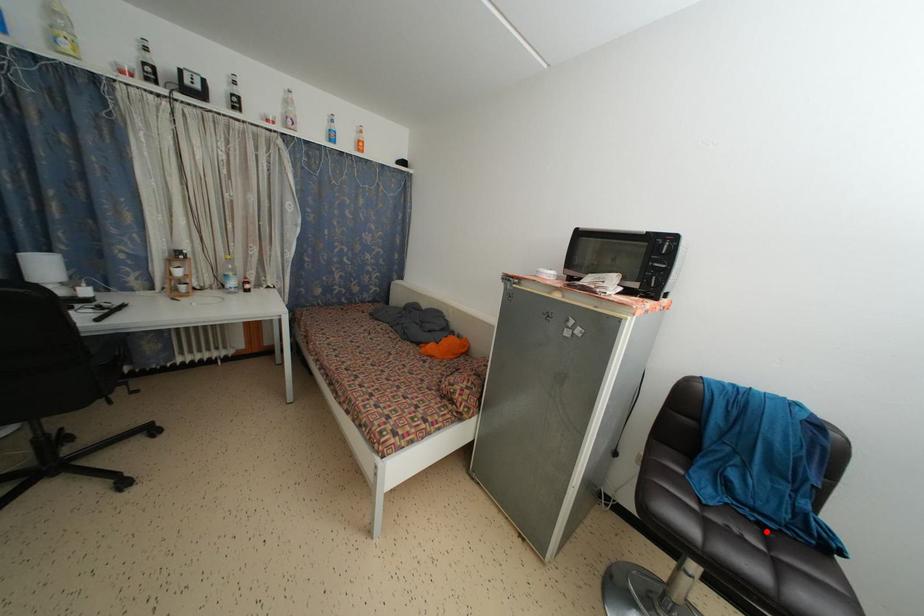
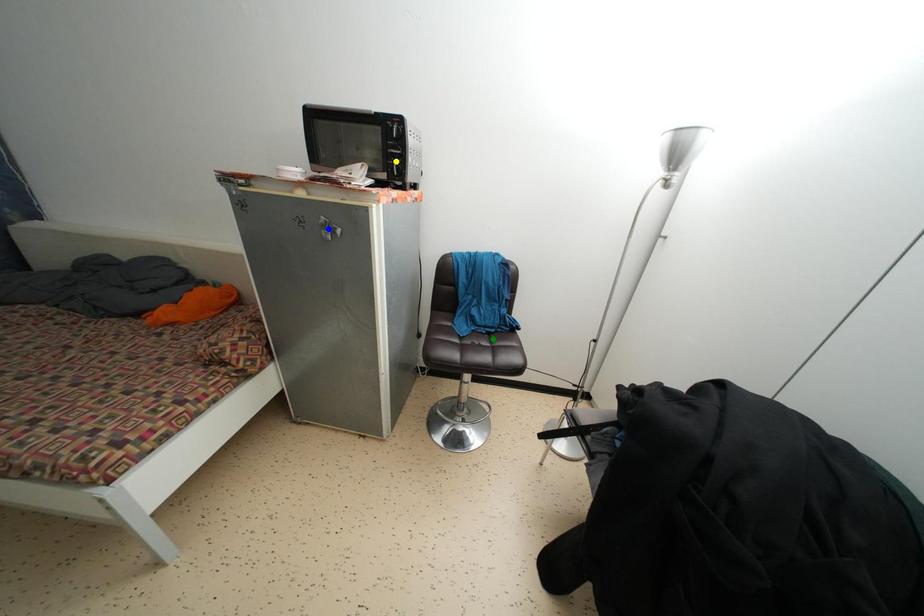
Question: I am providing you with two images of the same scene from different viewpoints. A red point is marked on the first image. You are given multiple points on the second image. In image 2, which mark is for the same physical point as the one in image 1?

Choices:
 (A) yellow point
 (B) blue point
 (C) green point

Answer: (C)